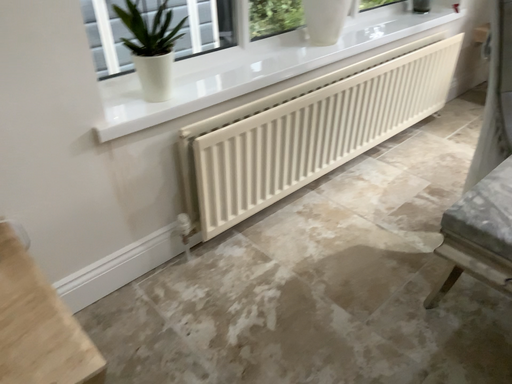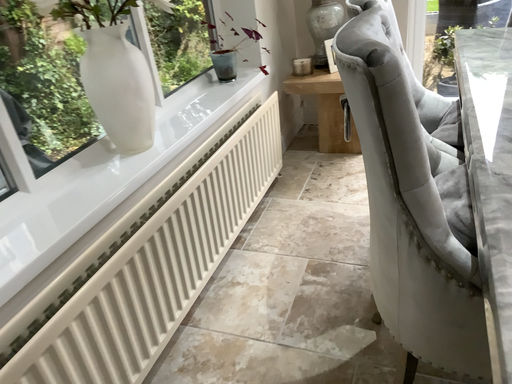
Question: How did the camera likely rotate when shooting the video?

Choices:
 (A) rotated upward
 (B) rotated downward

Answer: (A)